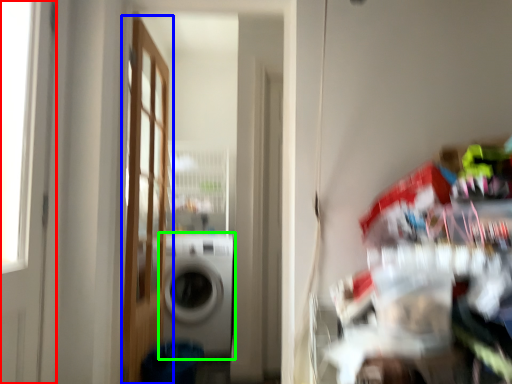
Question: Which is farther away from door (highlighted by a red box)? door (highlighted by a blue box) or washing machine (highlighted by a green box)?

Choices:
 (A) door
 (B) washing machine

Answer: (B)